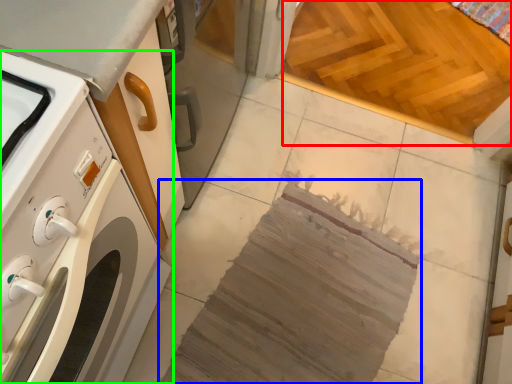
Question: Which is farther away from plywood (highlighted by a red box)? blanket (highlighted by a blue box) or home appliance (highlighted by a green box)?

Choices:
 (A) blanket
 (B) home appliance

Answer: (B)